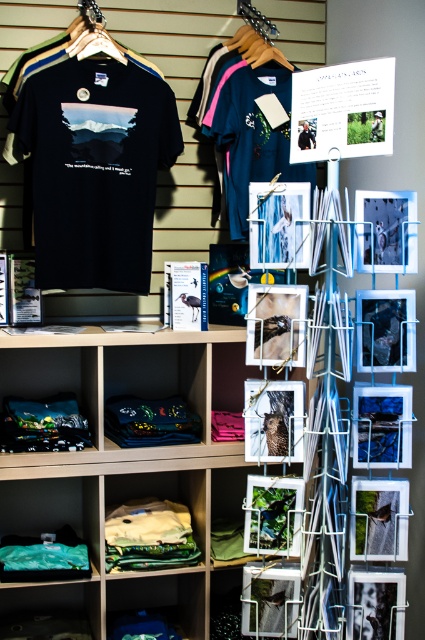
You are a customer in the store looking at the wooden bookshelf at center and the wooden hanger at upper center. Which object is larger?

The wooden bookshelf at center is bigger than the wooden hanger at upper center.

You are standing in front of the retail display and want to reach both points mentioned. Which point, point (107, 545) or point (101, 49), is closer to you?

Point (107, 545) is closer to you because it is further to the viewer than point (101, 49).